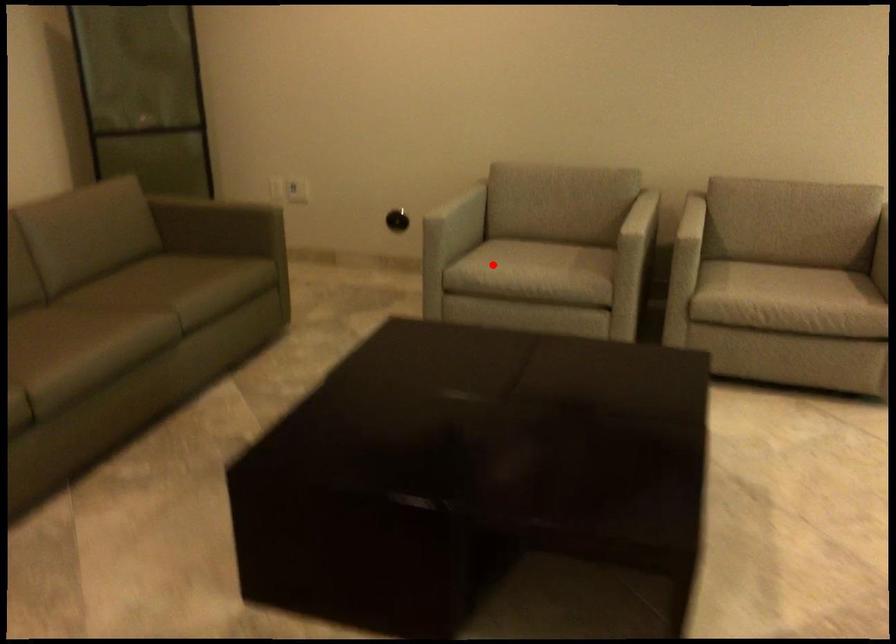
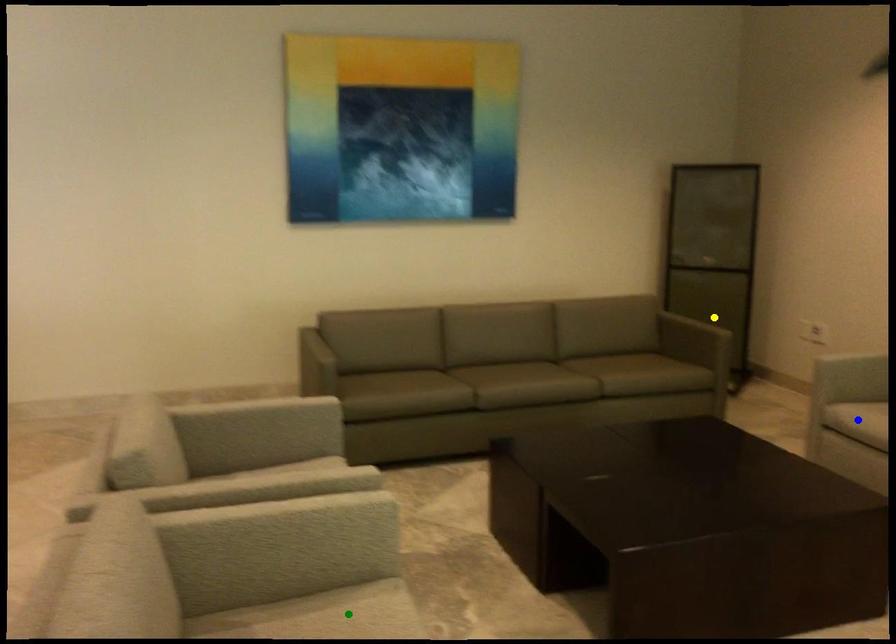
Question: I am providing you with two images of the same scene from different viewpoints. A red point is marked on the first image. You are given multiple points on the second image. Which spot in image 2 lines up with the point in image 1?

Choices:
 (A) green point
 (B) yellow point
 (C) blue point

Answer: (C)